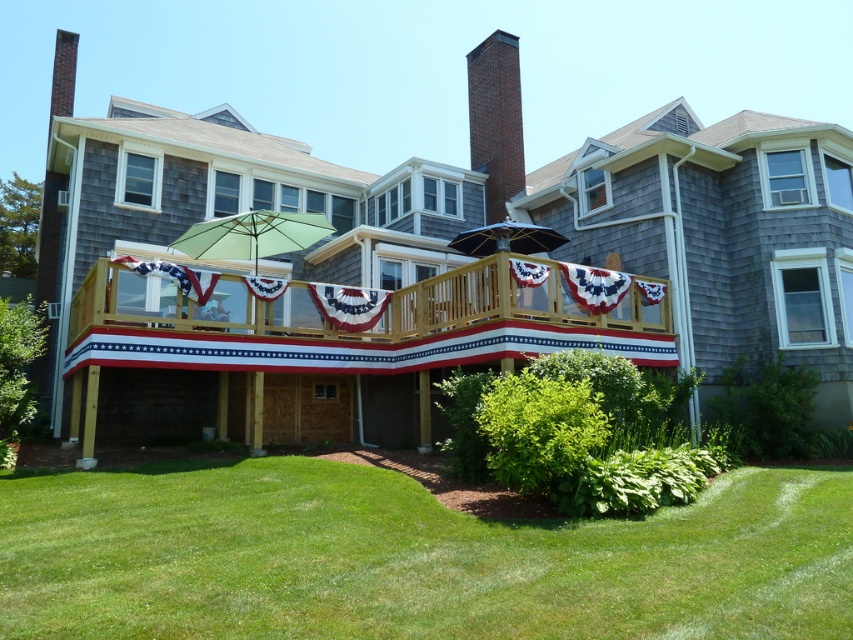
You are standing at the corner of the property and want to locate the brick chimney at center. According to the coordinates provided, where should you look relative to your position?

The brick chimney at center is located at coordinates point (495, 120), so you should look towards the lower left direction from your position at the corner to find it.

You are planning to install a new satellite dish on the brick chimney at center. However, you need to ensure that the dish will not be obstructed by the green fabric umbrella at center. Based on the scene description, will the chimney be tall enough to avoid obstruction from the umbrella?

The brick chimney at center has a greater height compared to the green fabric umbrella at center, so installing the satellite dish on the brick chimney at center will not be obstructed by the green fabric umbrella at center.

You are planning to install a new garden sprinkler system. The sprinkler has a maximum range of 50 feet. If you position the sprinkler at the green grass at lower center, will it be able to water the brick chimney at center?

The distance between the green grass at lower center and the brick chimney at center is 47.44 feet, which is within the sprinkler system maximum range of 50 feet. Therefore, the sprinkler can water the brick chimney at center.